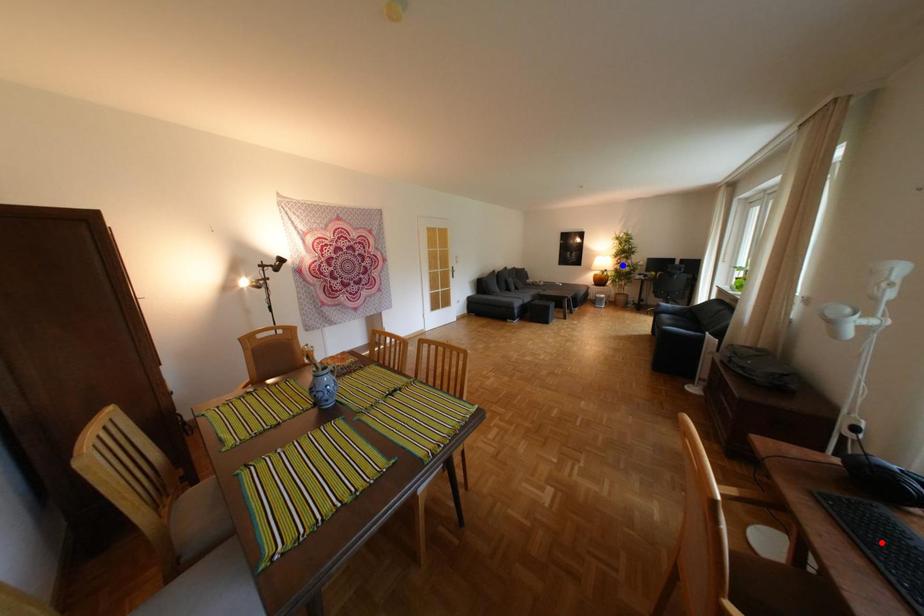
Question: In the image, two points are highlighted. Which point is nearer to the camera? Reply with the corresponding letter.

Choices:
 (A) blue point
 (B) red point

Answer: (B)